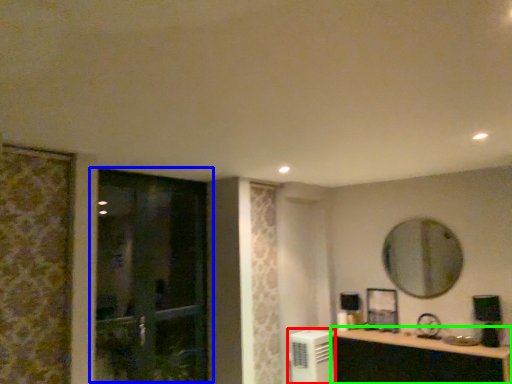
Question: Estimate the real-world distances between objects in this image. Which object is closer to air conditioner (highlighted by a red box), door (highlighted by a blue box) or cabinetry (highlighted by a green box)?

Choices:
 (A) door
 (B) cabinetry

Answer: (B)